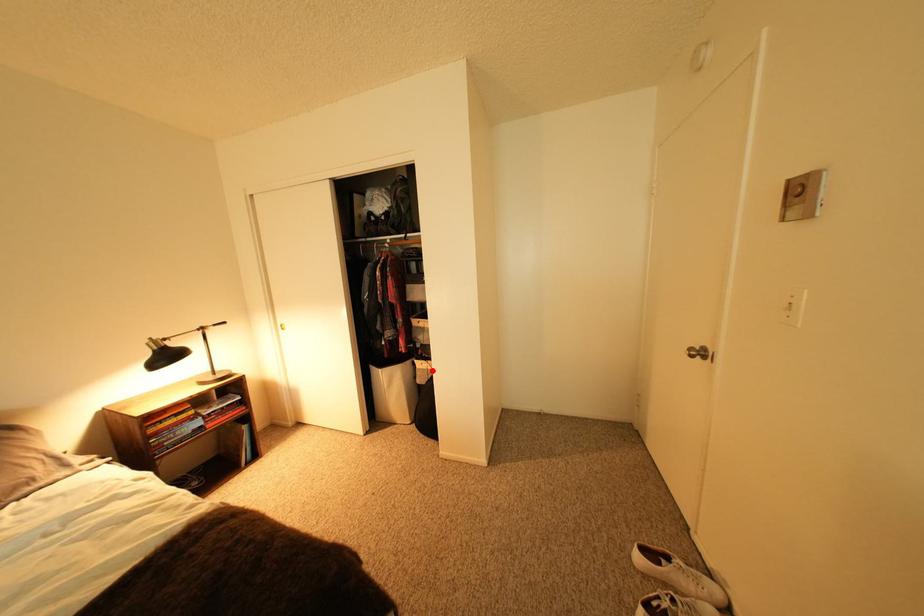
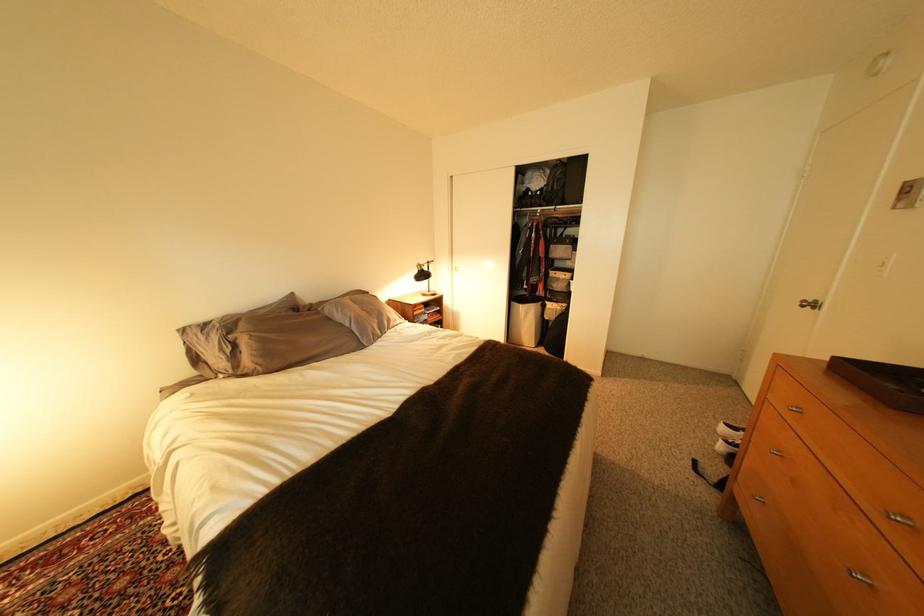
Find the pixel in the second image that matches the highlighted location in the first image.

(563, 310)